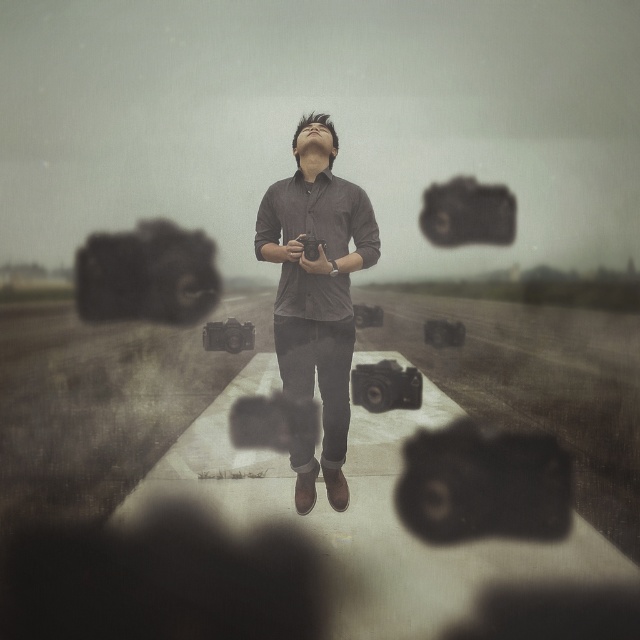
Question: Observing the image, what is the correct spatial positioning of matte gray shirt at center in reference to matte black camera at upper center?

Choices:
 (A) right
 (B) left

Answer: (B)

Question: Is matte gray shirt at center above matte black camera at upper center?

Choices:
 (A) no
 (B) yes

Answer: (A)

Question: Which point is farther from the camera taking this photo?

Choices:
 (A) (456, 218)
 (B) (349, 308)

Answer: (B)

Question: Which point is farther to the camera?

Choices:
 (A) matte black camera at upper center
 (B) matte gray shirt at center

Answer: (B)

Question: Observing the image, what is the correct spatial positioning of matte gray shirt at center in reference to matte black camera at upper center?

Choices:
 (A) below
 (B) above

Answer: (A)